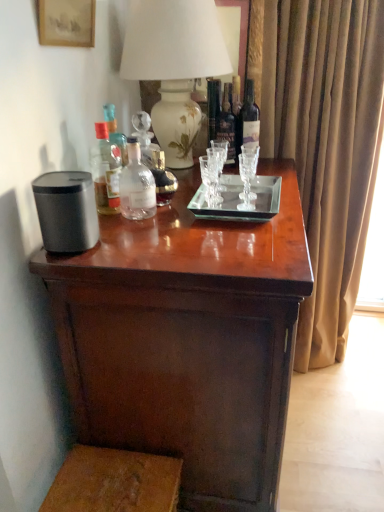
Locate an element on the screen. The image size is (384, 512). free spot to the right of clear glass bottle at center, acting as the third bottle starting from the left is located at coordinates (215, 218).